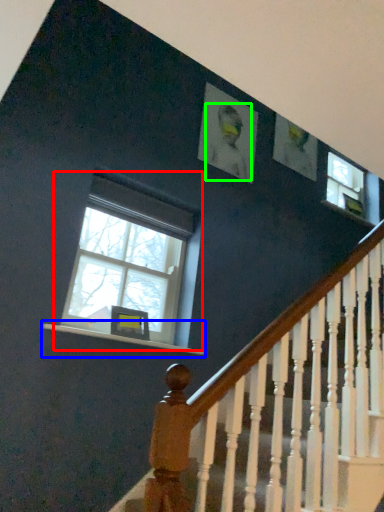
Question: Which is farther away from window (highlighted by a red box)? window sill (highlighted by a blue box) or person (highlighted by a green box)?

Choices:
 (A) window sill
 (B) person

Answer: (B)